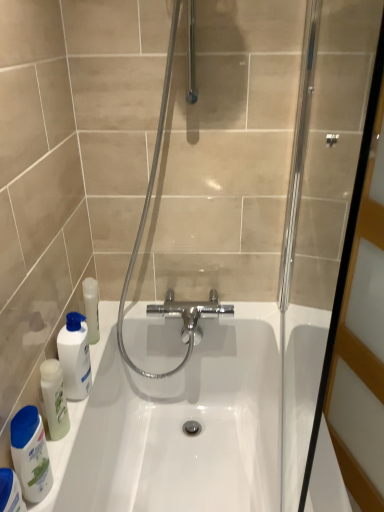
Locate an element on the screen. This screenshot has width=384, height=512. translucent plastic bottle at lower left, which appears as the first cleaning product when viewed from the front is located at coordinates (10, 492).

What do you see at coordinates (10, 492) in the screenshot? The width and height of the screenshot is (384, 512). I see `translucent plastic bottle at lower left, the 3th cleaning product positioned from the back` at bounding box center [10, 492].

What do you see at coordinates (30, 454) in the screenshot? I see `white glossy bottle at lower left, positioned as the 2th cleaning product in front-to-back order` at bounding box center [30, 454].

Describe the element at coordinates (177, 425) in the screenshot. Image resolution: width=384 pixels, height=512 pixels. I see `white glossy bathtub at lower left` at that location.

Find the location of a particular element. The image size is (384, 512). white glossy bathtub at lower left is located at coordinates (177, 425).

Find the location of a particular element. This screenshot has height=512, width=384. white glossy mouthwash at left is located at coordinates (75, 356).

From the image's perspective, which is below, white glossy bathtub at lower left or white glossy mouthwash at left?

white glossy bathtub at lower left is shown below in the image.

Is the depth of white glossy bathtub at lower left greater than that of white glossy mouthwash at left?

No, white glossy bathtub at lower left is closer to the camera.

Is white glossy bathtub at lower left facing towards white glossy mouthwash at left?

No, white glossy bathtub at lower left is not turned towards white glossy mouthwash at left.

Considering the sizes of objects white glossy bathtub at lower left and white glossy mouthwash at left in the image provided, who is taller, white glossy bathtub at lower left or white glossy mouthwash at left?

white glossy bathtub at lower left.

Could you tell me if clear glass screen door at right is facing translucent plastic bottle at lower left, the 3th cleaning product positioned from the back?

No, clear glass screen door at right is not oriented towards translucent plastic bottle at lower left, the 3th cleaning product positioned from the back.

Which is farther from the camera, (361, 164) or (15, 506)?

The point (15, 506) is farther.

Between clear glass screen door at right and translucent plastic bottle at lower left, the 3th cleaning product positioned from the back, which one has less height?

Standing shorter between the two is translucent plastic bottle at lower left, the 3th cleaning product positioned from the back.

Locate an element on the screen. The image size is (384, 512). the 3rd cleaning product to the left of the clear glass screen door at right, counting from the anchor's position is located at coordinates (10, 492).

Measure the distance between clear glass screen door at right and white glossy mouthwash at left.

clear glass screen door at right is 28.44 inches away from white glossy mouthwash at left.

Is clear glass screen door at right not inside white glossy mouthwash at left?

Indeed, clear glass screen door at right is completely outside white glossy mouthwash at left.

Who is smaller, clear glass screen door at right or white glossy mouthwash at left?

white glossy mouthwash at left is smaller.

Which is in front, clear glass screen door at right or white glossy mouthwash at left?

clear glass screen door at right is closer to the camera.

Looking at this image, does clear glass screen door at right have a greater width compared to translucent plastic bottle at lower left, the 3th cleaning product in the front-to-back sequence?

Yes, clear glass screen door at right is wider than translucent plastic bottle at lower left, the 3th cleaning product in the front-to-back sequence.

Are clear glass screen door at right and translucent plastic bottle at lower left, the first cleaning product from the back, located far from each other?

They are positioned close to each other.

Is point (302, 467) more distant than point (61, 377)?

That is True.

From the image's perspective, between clear glass screen door at right and translucent plastic bottle at lower left, the first cleaning product from the back, who is located below?

translucent plastic bottle at lower left, the first cleaning product from the back, appears lower in the image.

Is white glossy mouthwash at left turned away from clear glass screen door at right?

No, white glossy mouthwash at left is not facing the opposite direction of clear glass screen door at right.

Which of these two, white glossy mouthwash at left or clear glass screen door at right, is wider?

Wider between the two is white glossy mouthwash at left.

Does white glossy mouthwash at left have a greater height compared to clear glass screen door at right?

Incorrect, the height of white glossy mouthwash at left is not larger of that of clear glass screen door at right.

From the image's perspective, would you say white glossy mouthwash at left is positioned over clear glass screen door at right?

No.

Choose the correct answer: Is white glossy bottle at lower left, positioned as the 2th cleaning product in front-to-back order, inside white glossy bathtub at lower left or outside it?

white glossy bottle at lower left, positioned as the 2th cleaning product in front-to-back order, cannot be found inside white glossy bathtub at lower left.

Locate an element on the screen. This screenshot has height=512, width=384. bath below the white glossy bottle at lower left, which is the second cleaning product in back-to-front order (from a real-world perspective) is located at coordinates (177, 425).

Does white glossy bottle at lower left, which is the second cleaning product in back-to-front order, have a lesser height compared to white glossy bathtub at lower left?

Indeed, white glossy bottle at lower left, which is the second cleaning product in back-to-front order, has a lesser height compared to white glossy bathtub at lower left.

From the picture: How many degrees apart are the facing directions of white glossy bottle at lower left, which is the second cleaning product in back-to-front order, and white glossy bathtub at lower left?

The angular difference between white glossy bottle at lower left, which is the second cleaning product in back-to-front order, and white glossy bathtub at lower left is 1.03 degrees.

Considering the relative sizes of white glossy bathtub at lower left and translucent plastic bottle at lower left, the first cleaning product from the back, in the image provided, is white glossy bathtub at lower left wider than translucent plastic bottle at lower left, the first cleaning product from the back,?

Indeed, white glossy bathtub at lower left has a greater width compared to translucent plastic bottle at lower left, the first cleaning product from the back.

Would you say white glossy bathtub at lower left contains translucent plastic bottle at lower left, the 3th cleaning product in the front-to-back sequence?

No, translucent plastic bottle at lower left, the 3th cleaning product in the front-to-back sequence, is not inside white glossy bathtub at lower left.

Is white glossy bathtub at lower left in front of translucent plastic bottle at lower left, the 3th cleaning product in the front-to-back sequence?

Yes, it is.

Is white glossy bathtub at lower left far away from translucent plastic bottle at lower left, the first cleaning product from the back?

white glossy bathtub at lower left is near translucent plastic bottle at lower left, the first cleaning product from the back, not far away.

At what (x,y) coordinates should I click in order to perform the action: click on bath that appears below the white glossy mouthwash at left (from the image's perspective). Please return your answer as a coordinate pair (x, y). Looking at the image, I should click on (177, 425).

Locate an element on the screen. cleaning product that is the 3rd one below the clear glass screen door at right (from a real-world perspective) is located at coordinates (10, 492).

When comparing their distances from clear glass screen door at right, does translucent plastic bottle at lower left, the first cleaning product from the back, or white glossy bottle at lower left, positioned as the 2th cleaning product in front-to-back order, seem further?

white glossy bottle at lower left, positioned as the 2th cleaning product in front-to-back order, lies further to clear glass screen door at right than the other object.

Based on their spatial positions, is white glossy bottle at lower left, which is the second cleaning product in back-to-front order, or white glossy bathtub at lower left further from translucent plastic bottle at lower left, the 3th cleaning product positioned from the back?

white glossy bathtub at lower left lies further to translucent plastic bottle at lower left, the 3th cleaning product positioned from the back, than the other object.

Looking at the image, which one is located closer to white glossy mouthwash at left, white glossy bottle at lower left, which is the second cleaning product in back-to-front order, or clear glass screen door at right?

white glossy bottle at lower left, which is the second cleaning product in back-to-front order, is closer to white glossy mouthwash at left.

Estimate the real-world distances between objects in this image. Which object is closer to translucent plastic bottle at lower left, the first cleaning product from the back, white glossy bottle at lower left, positioned as the 2th cleaning product in front-to-back order, or white glossy mouthwash at left?

white glossy mouthwash at left is positioned closer to the anchor translucent plastic bottle at lower left, the first cleaning product from the back.

Looking at the image, which one is located closer to translucent plastic bottle at lower left, which appears as the first cleaning product when viewed from the front, translucent plastic bottle at lower left, the first cleaning product from the back, or white glossy mouthwash at left?

The object closer to translucent plastic bottle at lower left, which appears as the first cleaning product when viewed from the front, is translucent plastic bottle at lower left, the first cleaning product from the back.

Looking at the image, which one is located further to translucent plastic bottle at lower left, the 3th cleaning product in the front-to-back sequence, white glossy bathtub at lower left or white glossy bottle at lower left, which is the second cleaning product in back-to-front order?

Among the two, white glossy bathtub at lower left is located further to translucent plastic bottle at lower left, the 3th cleaning product in the front-to-back sequence.

Considering their positions, is white glossy mouthwash at left positioned further to white glossy bathtub at lower left than translucent plastic bottle at lower left, the 3th cleaning product positioned from the back?

Among the two, translucent plastic bottle at lower left, the 3th cleaning product positioned from the back, is located further to white glossy bathtub at lower left.

When comparing their distances from white glossy bottle at lower left, which is the second cleaning product in back-to-front order, does white glossy bathtub at lower left or translucent plastic bottle at lower left, the first cleaning product from the back, seem further?

The object further to white glossy bottle at lower left, which is the second cleaning product in back-to-front order, is white glossy bathtub at lower left.

Locate an element on the screen. mouthwash located between translucent plastic bottle at lower left, the 3th cleaning product in the front-to-back sequence, and white glossy bathtub at lower left in the left-right direction is located at coordinates (75, 356).

Find the location of a particular element. mouthwash located between white glossy bottle at lower left, positioned as the 2th cleaning product in front-to-back order, and white glossy bathtub at lower left in the left-right direction is located at coordinates (75, 356).

Locate an element on the screen. This screenshot has width=384, height=512. bath located between clear glass screen door at right and white glossy mouthwash at left in the depth direction is located at coordinates (177, 425).

Find the location of `cleaning product between translucent plastic bottle at lower left, the 3th cleaning product positioned from the back, and translucent plastic bottle at lower left, the 3th cleaning product in the front-to-back sequence, in the front-back direction`. cleaning product between translucent plastic bottle at lower left, the 3th cleaning product positioned from the back, and translucent plastic bottle at lower left, the 3th cleaning product in the front-to-back sequence, in the front-back direction is located at coordinates (30, 454).